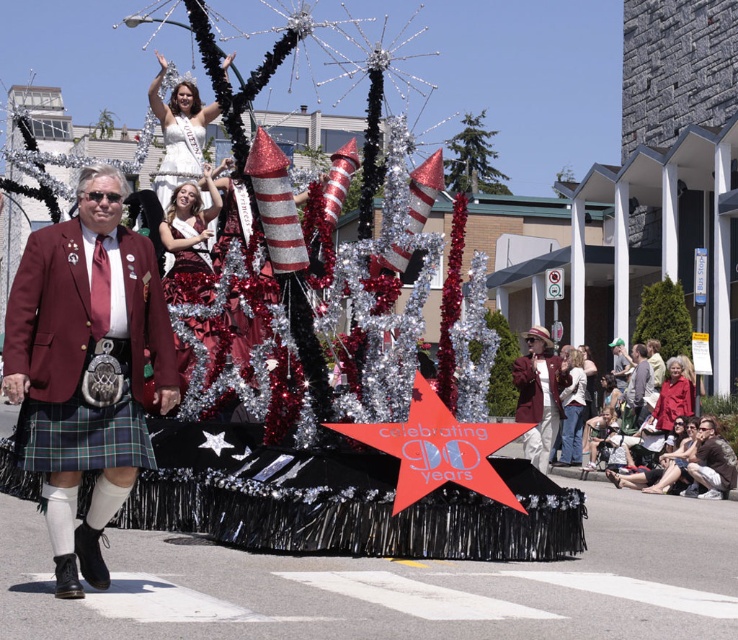
Question: Which point is closer to the camera?

Choices:
 (A) shiny red dress at center
 (B) maroon fabric jacket at center

Answer: (A)

Question: Which object is closer to the camera taking this photo?

Choices:
 (A) maroon wool jacket at center
 (B) shiny silver dress at center
 (C) shiny red dress at center
 (D) green fabric cap at upper center

Answer: (A)

Question: Which point is closer to the camera taking this photo?

Choices:
 (A) (573, 348)
 (B) (635, 403)
 (C) (562, 368)
 (D) (168, 236)

Answer: (D)

Question: Does shiny silver dress at center have a lesser width compared to green fabric jacket at lower right?

Choices:
 (A) yes
 (B) no

Answer: (B)

Question: Does shiny red dress at center have a smaller size compared to matte white blouse at center?

Choices:
 (A) no
 (B) yes

Answer: (B)

Question: Does white satin sash at center have a larger size compared to matte white blouse at center?

Choices:
 (A) yes
 (B) no

Answer: (A)